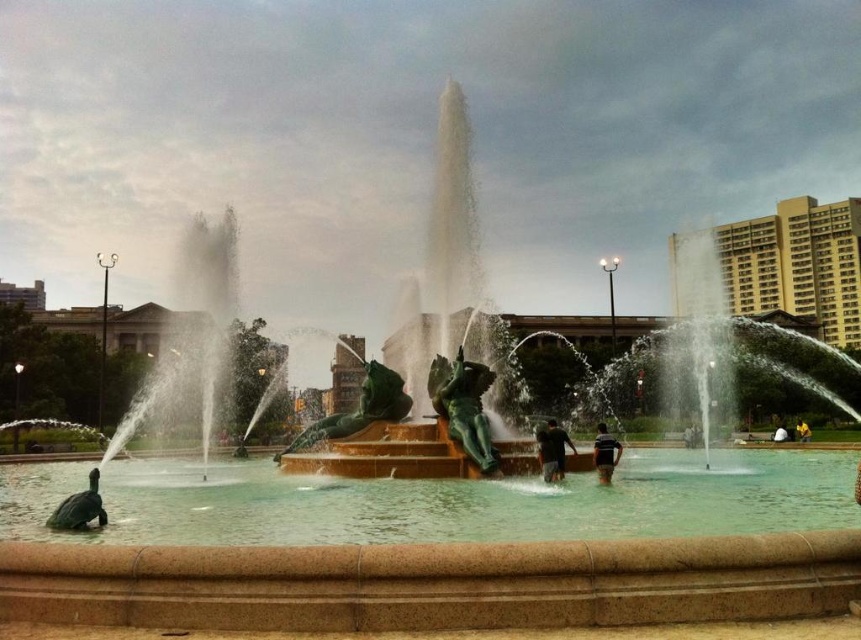
You are standing in a city park and want to take a photo of the green patina statue at center. If your camera has a maximum focus range of 50 meters, will you be able to capture a clear image without moving closer?

The green patina statue at center is 47.42 meters away from the viewer. Since the camera can focus up to 50 meters, it is within range, so yes, you can capture a clear image without moving closer.

You are standing in the urban scene and see the fountain with two green mythological creatures at the base. There is also a black matte shirt at center marked by point (605, 452). Which object is closer to you, the green mythological creatures or the black matte shirt at center?

The black matte shirt at center marked by point (605, 452) is closer to you than the green mythological creatures at the base of the fountain.